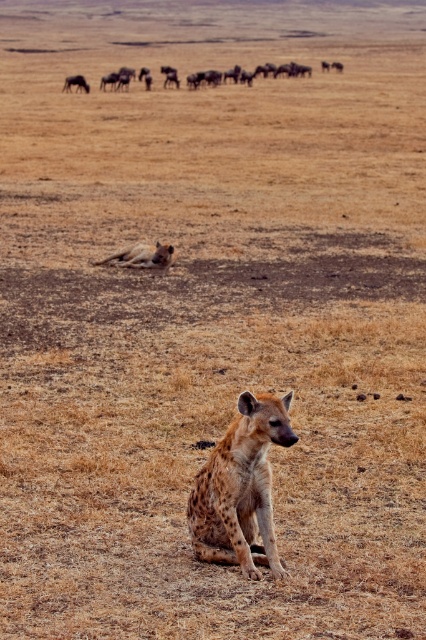
Question: Which of the following is the closest to the observer?

Choices:
 (A) brown textured herd at upper center
 (B) spotted hyena at center
 (C) spotted hyena at upper left
 (D) spotted fur hyaena at center

Answer: (D)

Question: Is brown textured herd at upper center wider than spotted hyena at upper left?

Choices:
 (A) no
 (B) yes

Answer: (B)

Question: Considering the relative positions of spotted fur hyena at center and spotted hyena at upper left in the image provided, where is spotted fur hyena at center located with respect to spotted hyena at upper left?

Choices:
 (A) left
 (B) right

Answer: (B)

Question: Among these objects, which one is farthest from the camera?

Choices:
 (A) brown textured herd at upper center
 (B) spotted fur hyena at center

Answer: (A)

Question: Which object is farther from the camera taking this photo?

Choices:
 (A) spotted hyena at upper left
 (B) spotted fur hyena at center
 (C) spotted hyena at center
 (D) brown textured herd at upper center

Answer: (C)

Question: Can you confirm if brown textured herd at upper center is positioned to the left of spotted fur hyena at center?

Choices:
 (A) yes
 (B) no

Answer: (B)